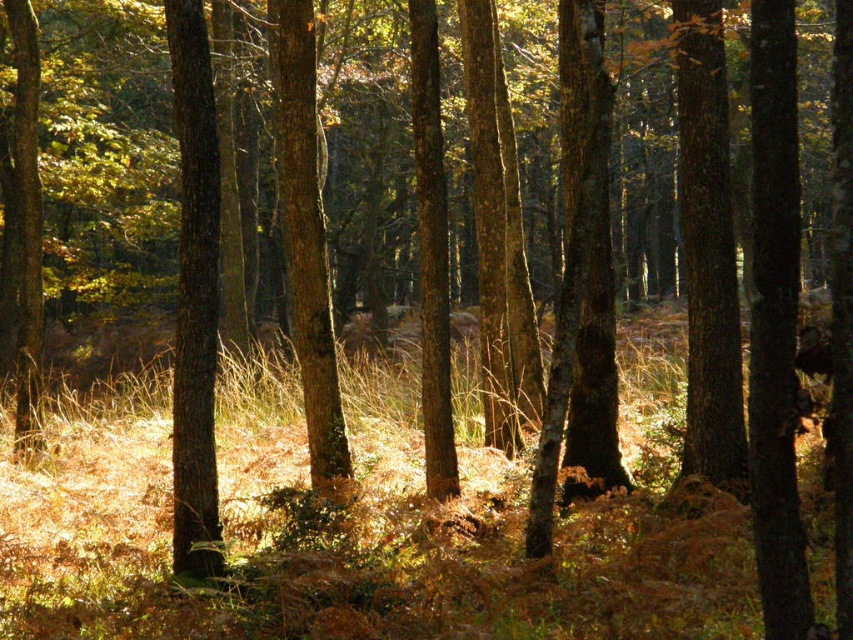
This screenshot has width=853, height=640. Describe the element at coordinates (706, 256) in the screenshot. I see `smooth brown tree trunk at right` at that location.

Measure the distance between smooth brown tree trunk at right and camera.

The distance of smooth brown tree trunk at right from camera is 9.73 meters.

You are a GUI agent. You are given a task and a screenshot of the screen. Output one action in this format:
    pyautogui.click(x=<x>, y=<y>)
    Task: Click on the smooth brown tree trunk at right
    The width and height of the screenshot is (853, 640).
    Given the screenshot: What is the action you would take?
    pyautogui.click(x=706, y=256)

Does brown dry grass at center appear on the right side of smooth bark tree at center?

Incorrect, brown dry grass at center is not on the right side of smooth bark tree at center.

Identify the location of brown dry grass at center. Image resolution: width=853 pixels, height=640 pixels. (358, 528).

Who is more distant from viewer, (367, 628) or (582, 253)?

The point (582, 253) is behind.

Locate an element on the screen. brown dry grass at center is located at coordinates (358, 528).

Can you confirm if smooth brown tree trunk at right is bigger than smooth brown tree trunk at left?

Correct, smooth brown tree trunk at right is larger in size than smooth brown tree trunk at left.

What do you see at coordinates (706, 256) in the screenshot? The image size is (853, 640). I see `smooth brown tree trunk at right` at bounding box center [706, 256].

Between point (712, 369) and point (189, 291), which one is positioned behind?

Point (712, 369)

Locate an element on the screen. This screenshot has height=640, width=853. smooth brown tree trunk at right is located at coordinates (706, 256).